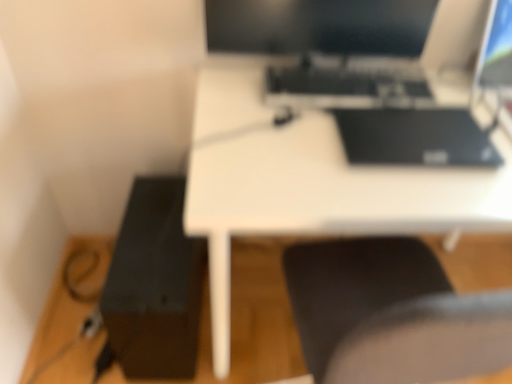
Question: Is white matte desk at center surrounded by black matte keyboard at center?

Choices:
 (A) no
 (B) yes

Answer: (A)

Question: Can you confirm if black matte keyboard at center is smaller than white matte desk at center?

Choices:
 (A) yes
 (B) no

Answer: (A)

Question: Is black matte keyboard at center taller than white matte desk at center?

Choices:
 (A) no
 (B) yes

Answer: (A)

Question: Is the depth of black matte keyboard at center greater than that of white matte desk at center?

Choices:
 (A) no
 (B) yes

Answer: (B)

Question: Is black matte keyboard at center oriented towards white matte desk at center?

Choices:
 (A) yes
 (B) no

Answer: (B)

Question: Looking at the image, does black matte keyboard at center seem bigger or smaller compared to black glossy monitor at upper center?

Choices:
 (A) big
 (B) small

Answer: (B)

Question: Relative to black glossy monitor at upper center, is black matte keyboard at center in front or behind?

Choices:
 (A) behind
 (B) front

Answer: (A)

Question: Is point (312, 74) closer or farther from the camera than point (391, 13)?

Choices:
 (A) closer
 (B) farther

Answer: (B)

Question: Looking at their shapes, would you say black matte keyboard at center is wider or thinner than black glossy monitor at upper center?

Choices:
 (A) wide
 (B) thin

Answer: (A)

Question: Which is correct: black matte printer at lower left is inside black glossy monitor at upper center, or outside of it?

Choices:
 (A) inside
 (B) outside

Answer: (B)

Question: From a real-world perspective, relative to black glossy monitor at upper center, is black matte printer at lower left vertically above or below?

Choices:
 (A) below
 (B) above

Answer: (A)

Question: From the image's perspective, relative to black glossy monitor at upper center, is black matte printer at lower left above or below?

Choices:
 (A) below
 (B) above

Answer: (A)

Question: Considering the positions of black matte printer at lower left and black glossy monitor at upper center in the image, is black matte printer at lower left bigger or smaller than black glossy monitor at upper center?

Choices:
 (A) big
 (B) small

Answer: (A)

Question: Considering the positions of black glossy monitor at upper center and black matte printer at lower left in the image, is black glossy monitor at upper center wider or thinner than black matte printer at lower left?

Choices:
 (A) wide
 (B) thin

Answer: (B)

Question: From the image's perspective, relative to black matte printer at lower left, is black glossy monitor at upper center above or below?

Choices:
 (A) below
 (B) above

Answer: (B)